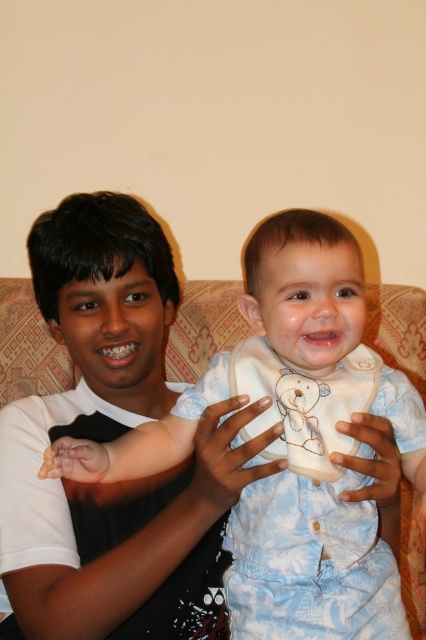
Looking at this image, can you confirm if white soft bib at center is taller than dark skin hand at center?

Indeed, white soft bib at center has a greater height compared to dark skin hand at center.

The height and width of the screenshot is (640, 426). Find the location of `white soft bib at center`. white soft bib at center is located at coordinates (308, 563).

Between white soft bib at center and white matte hand at center, which one has less height?

white matte hand at center

The height and width of the screenshot is (640, 426). What are the coordinates of `white soft bib at center` in the screenshot? It's located at (308, 563).

Is point (264, 474) farther from viewer compared to point (348, 499)?

No, (264, 474) is closer to viewer.

Which is in front, point (224, 451) or point (391, 468)?

Positioned in front is point (224, 451).

Find the location of a particular element. Image resolution: width=426 pixels, height=640 pixels. dark skin hand at center is located at coordinates (227, 454).

This screenshot has width=426, height=640. Find the location of `dark skin hand at center`. dark skin hand at center is located at coordinates (227, 454).